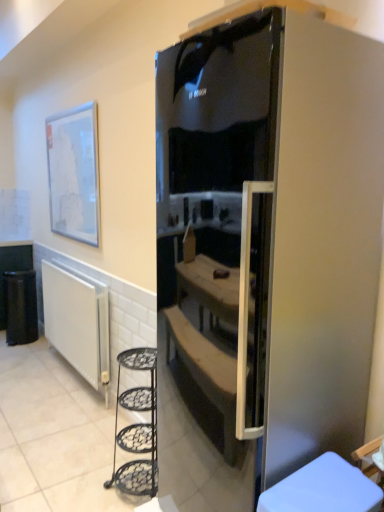
What are the coordinates of `free location above white plastic stool at lower right (from a real-world perspective)` in the screenshot? It's located at (318, 477).